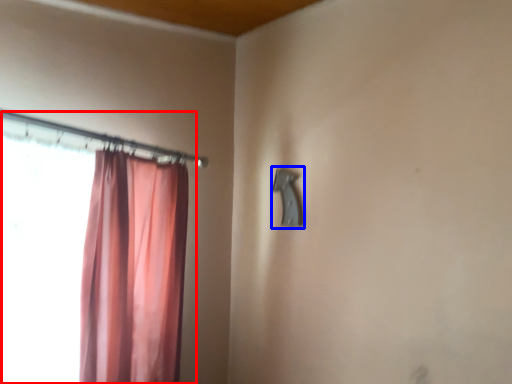
Question: Which of the following is the farthest to the observer, curtain (highlighted by a red box) or door handle (highlighted by a blue box)?

Choices:
 (A) curtain
 (B) door handle

Answer: (B)